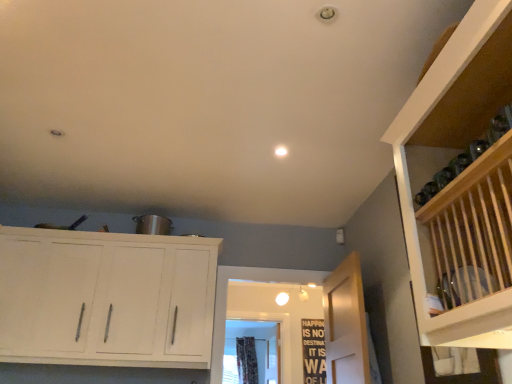
Question: Can you confirm if floral fabric curtain at center is thinner than wooden door at center?

Choices:
 (A) no
 (B) yes

Answer: (A)

Question: Is floral fabric curtain at center at the left side of wooden door at center?

Choices:
 (A) no
 (B) yes

Answer: (B)

Question: Is the depth of floral fabric curtain at center greater than that of wooden door at center?

Choices:
 (A) yes
 (B) no

Answer: (A)

Question: Could you tell me if floral fabric curtain at center is facing wooden door at center?

Choices:
 (A) no
 (B) yes

Answer: (B)

Question: Can you confirm if floral fabric curtain at center is smaller than wooden door at center?

Choices:
 (A) no
 (B) yes

Answer: (A)

Question: Is floral fabric curtain at center bigger than wooden door at center?

Choices:
 (A) yes
 (B) no

Answer: (A)

Question: Can you confirm if white wood cabinet at upper left is smaller than black wood signboard at center?

Choices:
 (A) no
 (B) yes

Answer: (A)

Question: Is white wood cabinet at upper left positioned behind black wood signboard at center?

Choices:
 (A) no
 (B) yes

Answer: (A)

Question: Is black wood signboard at center surrounded by white wood cabinet at upper left?

Choices:
 (A) yes
 (B) no

Answer: (B)

Question: Is white wood cabinet at upper left next to black wood signboard at center?

Choices:
 (A) yes
 (B) no

Answer: (B)

Question: Is white wood cabinet at upper left at the right side of black wood signboard at center?

Choices:
 (A) yes
 (B) no

Answer: (B)

Question: From a real-world perspective, is white wood cabinet at upper left below black wood signboard at center?

Choices:
 (A) yes
 (B) no

Answer: (B)

Question: Does black wood signboard at center turn towards floral fabric curtain at center?

Choices:
 (A) no
 (B) yes

Answer: (A)